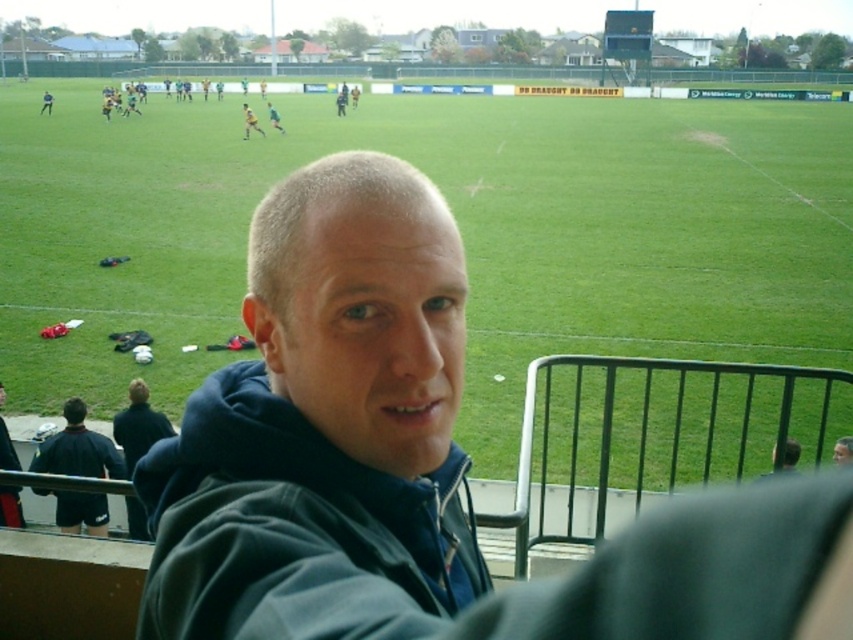
Who is more distant from viewer, (x=701, y=337) or (x=277, y=120)?

Point (x=277, y=120)

Find the location of `green grass football field at center`. green grass football field at center is located at coordinates (459, 225).

Does point (805, 257) lie in front of point (274, 122)?

Yes, point (805, 257) is in front of point (274, 122).

In order to click on green grass football field at center in this screenshot , I will do `click(459, 225)`.

Does dark blue jersey at lower left lie behind green jersey at center?

No, dark blue jersey at lower left is closer to the viewer.

Who is more forward, (x=80, y=406) or (x=274, y=124)?

Point (x=80, y=406) is in front.

Is point (30, 468) positioned behind point (267, 102)?

That is False.

What are the coordinates of `dark blue jersey at lower left` in the screenshot? It's located at (77, 449).

Is green grass football field at center above dark blue jersey at lower left?

Yes, green grass football field at center is above dark blue jersey at lower left.

Which is in front, point (496, 368) or point (71, 420)?

Point (71, 420)

Which is in front, point (718, 358) or point (90, 528)?

Point (90, 528) is in front.

Locate an element on the screen. The image size is (853, 640). green grass football field at center is located at coordinates (459, 225).